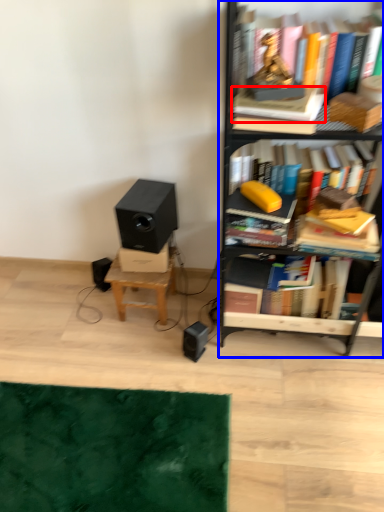
Question: Which of the following is the farthest to the observer, paperback book (highlighted by a red box) or bookcase (highlighted by a blue box)?

Choices:
 (A) paperback book
 (B) bookcase

Answer: (A)